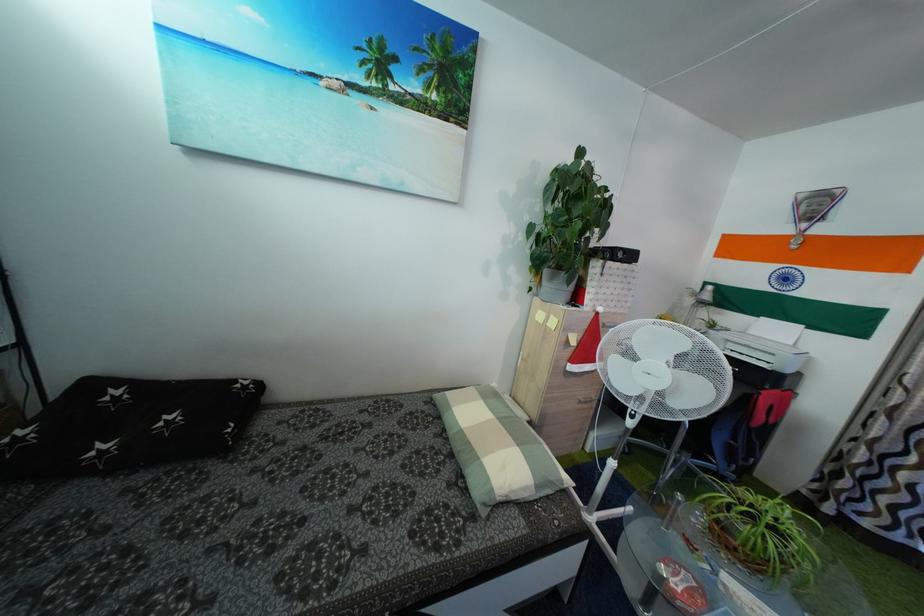
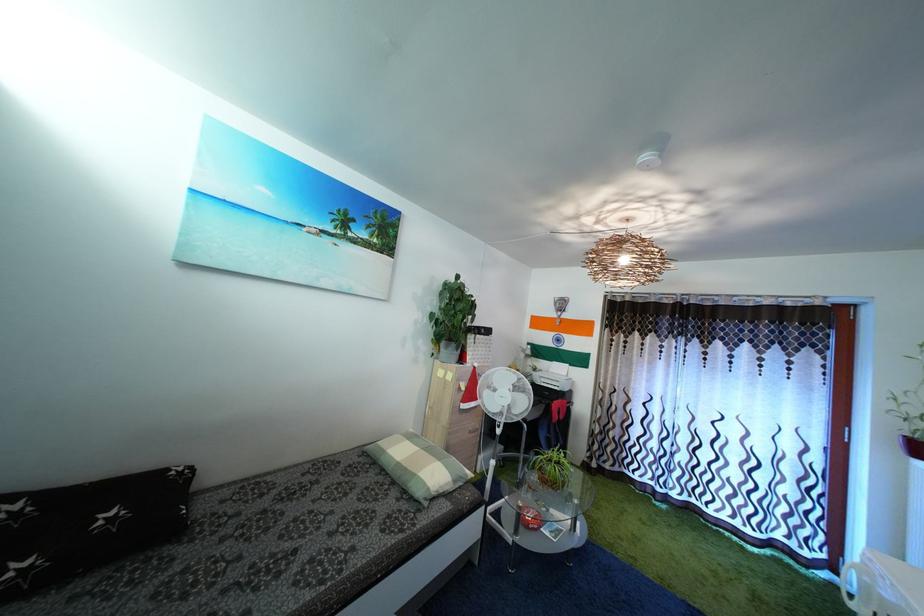
Question: The images are taken continuously from a first-person perspective. In which direction is your viewpoint rotating?

Choices:
 (A) Left
 (B) Right
 (C) Up
 (D) Down

Answer: (B)